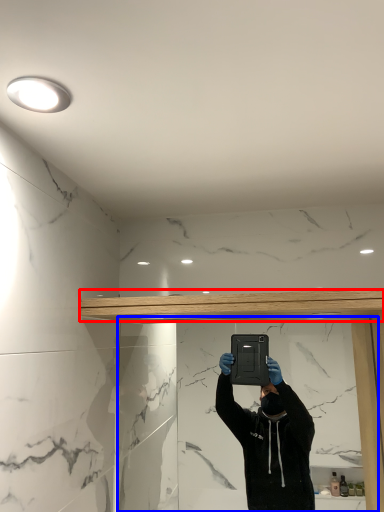
Question: Among these objects, which one is farthest to the camera, beam (highlighted by a red box) or mirror (highlighted by a blue box)?

Choices:
 (A) beam
 (B) mirror

Answer: (B)